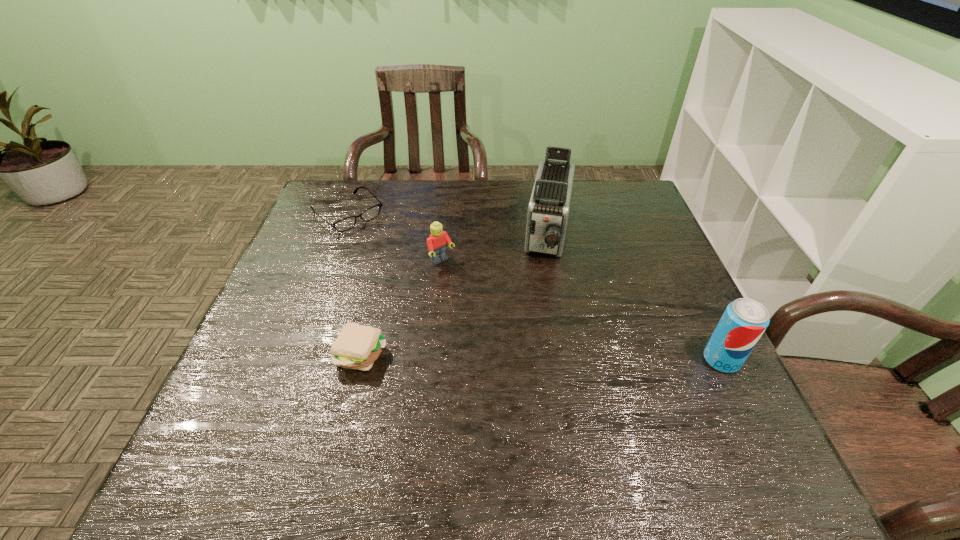
This screenshot has width=960, height=540. What are the coordinates of `vacant position at the near right corner of the desktop` in the screenshot? It's located at (684, 394).

Locate an element on the screen. The width and height of the screenshot is (960, 540). free spot between the third tallest object and the tallest object is located at coordinates (495, 248).

This screenshot has height=540, width=960. Find the location of `unoccupied position between the tallest object and the fourth tallest object`. unoccupied position between the tallest object and the fourth tallest object is located at coordinates (455, 295).

This screenshot has width=960, height=540. What are the coordinates of `vacant region between the rightmost object and the camcorder` in the screenshot? It's located at (635, 298).

The image size is (960, 540). I want to click on free area in between the Lego and the second tallest object, so click(582, 310).

Find the location of `unoccupied area between the spectacles and the second shortest object`. unoccupied area between the spectacles and the second shortest object is located at coordinates (355, 284).

This screenshot has width=960, height=540. I want to click on empty space that is in between the spectacles and the fourth object from left to right, so click(448, 225).

Locate an element on the screen. The width and height of the screenshot is (960, 540). vacant space in between the second tallest object and the fourth tallest object is located at coordinates (541, 357).

Image resolution: width=960 pixels, height=540 pixels. In order to click on vacant area that lies between the patty and the spectacles in this screenshot , I will do `click(355, 284)`.

In order to click on free area in between the camcorder and the soda can in this screenshot , I will do `click(635, 298)`.